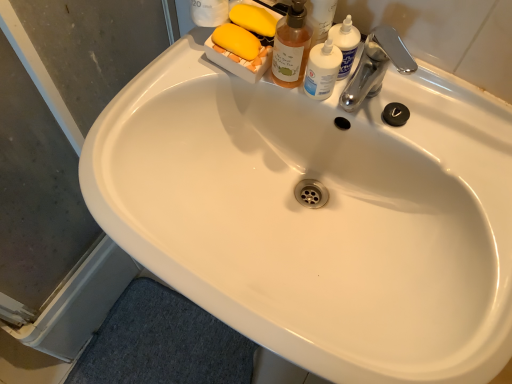
Image resolution: width=512 pixels, height=384 pixels. I want to click on vacant area that lies to the right of silver metallic faucet at upper right, so click(x=446, y=124).